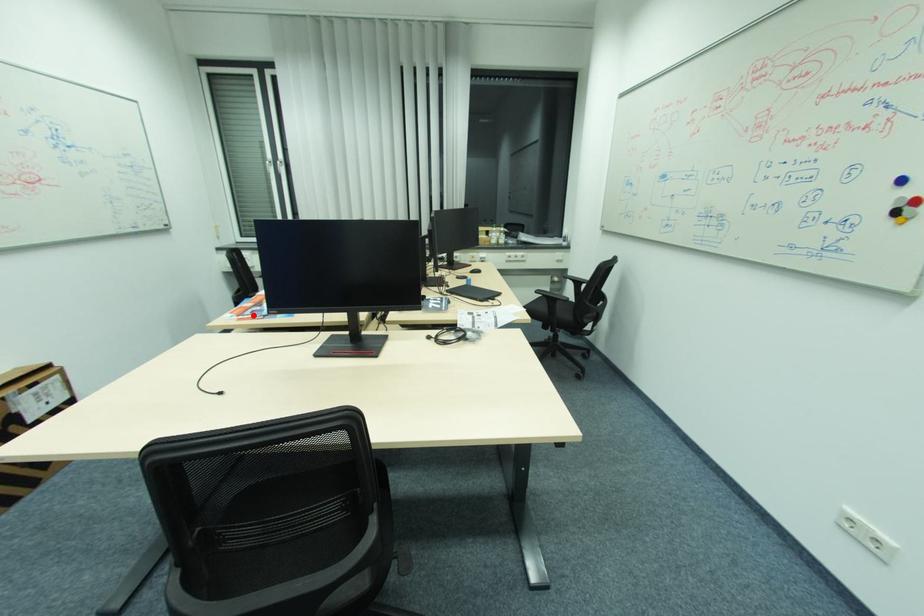
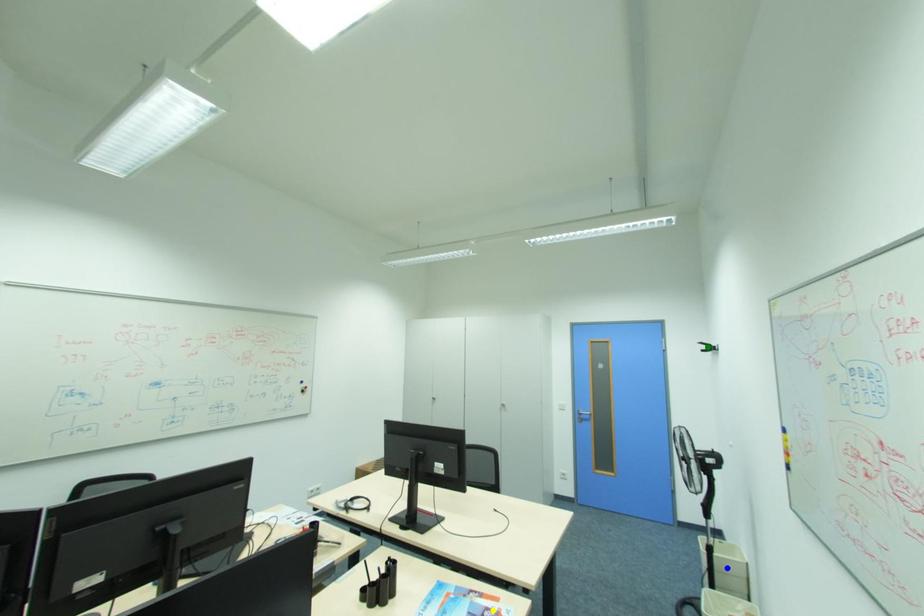
Question: I am providing you with two images of the same scene from different viewpoints. A red point is marked on the first image. You are given multiple points on the second image. Which point in image 2 is actually the same real-world point as the red point in image 1?

Choices:
 (A) yellow point
 (B) blue point
 (C) green point

Answer: (A)